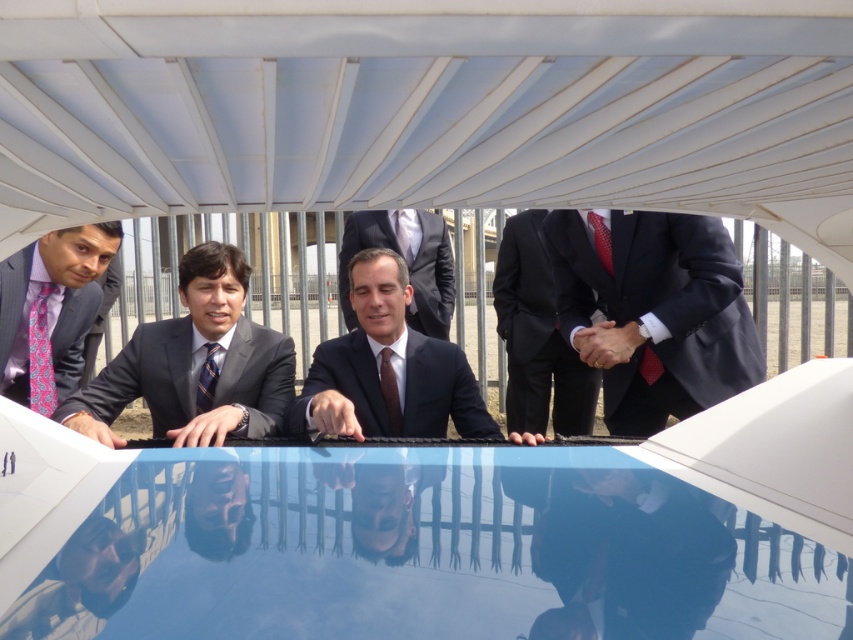
You are a tailor measuring the distance between two ties for a custom alteration. You need to ensure that the space between the brown silk tie at center and the red dotted tie at right is at least 30 inches to accommodate a special pin. Can the pin be safely attached based on the current distance?

The distance between the brown silk tie at center and the red dotted tie at right is 31.36 inches, which exceeds the required 30 inches. Therefore, the pin can be safely attached.

You are a photographer trying to capture a candid shot of the dark blue suit at right and the pink patterned tie at left. Your camera has a maximum focus range of 6 feet. Can you fit both subjects in frame without moving your position?

The dark blue suit at right and pink patterned tie at left are 5.90 feet apart from each other, which is within the camera maximum focus range of 6 feet. Yes, you can fit both subjects in frame without moving your position.